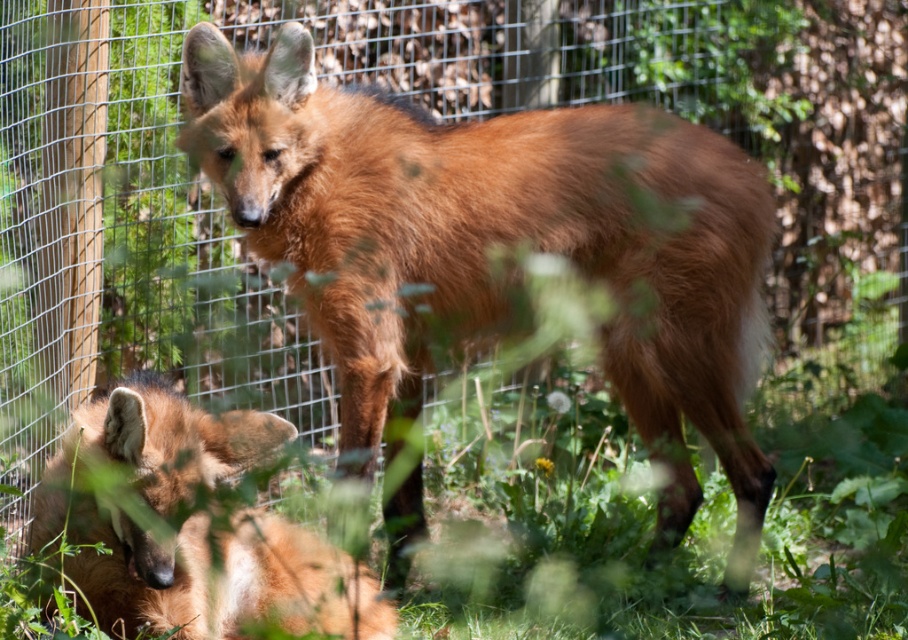
Question: Is brown furry fox at center positioned behind brown fur fox at lower left?

Choices:
 (A) yes
 (B) no

Answer: (A)

Question: Does brown furry fox at center have a lesser width compared to brown fur fox at lower left?

Choices:
 (A) yes
 (B) no

Answer: (B)

Question: Is brown furry fox at center behind brown fur fox at lower left?

Choices:
 (A) yes
 (B) no

Answer: (A)